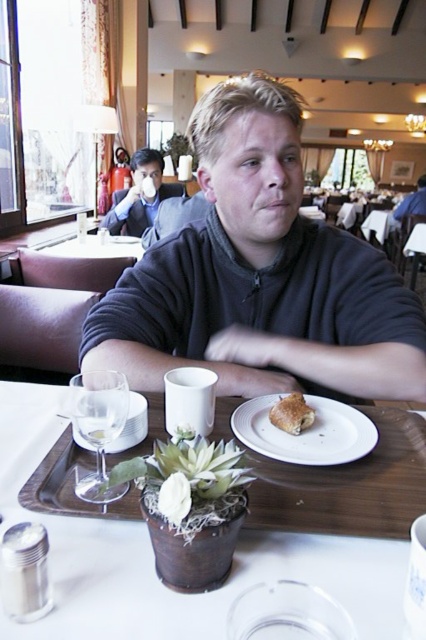
You are a waiter in a busy restaurant and need to carry both the wooden tray at lower center and the clear glass at lower left. Which object is wider so you can decide which to hold with both hands?

The wooden tray at lower center is wider than the clear glass at lower left, so you should hold the wooden tray at lower center with both hands.

You are a customer at the restaurant and want to place your phone on the table without covering the golden flaky pastry at center. Based on its position, where should you place your phone?

The golden flaky pastry at center is located at coordinates approximately 0.647 on the x axis and 0.685 on the y axis. To avoid covering it, place your phone elsewhere on the table, such as near the edges or corners away from these coordinates.

You are a customer in the restaurant and you see the point at coordinates (x=348, y=484). Where is this point located in relation to the wooden tray at lower center?

The point at coordinates (x=348, y=484) is located on the wooden tray at lower center.